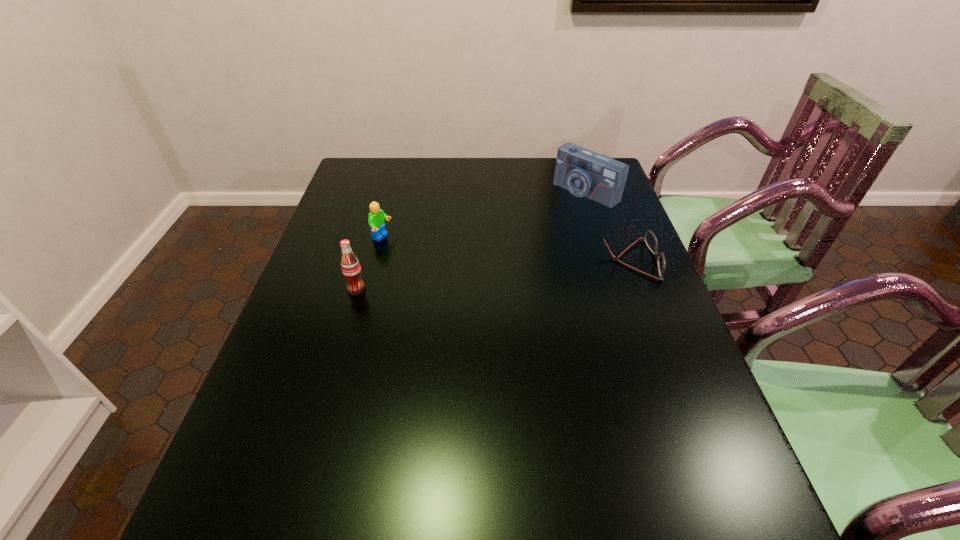
The image size is (960, 540). I want to click on the nearest object, so click(x=350, y=266).

Locate an element on the screen. The height and width of the screenshot is (540, 960). spectacles is located at coordinates (650, 239).

Find the location of a particular element. This screenshot has width=960, height=540. the farthest object is located at coordinates (584, 173).

You are a GUI agent. You are given a task and a screenshot of the screen. Output one action in this format:
    pyautogui.click(x=<x>, y=<y>)
    Task: Click on the third tallest object
    The width and height of the screenshot is (960, 540).
    Given the screenshot: What is the action you would take?
    pyautogui.click(x=376, y=219)

This screenshot has width=960, height=540. In order to click on free location located 0.150m on the right of the nearest object in this screenshot , I will do `click(424, 289)`.

Find the location of a particular element. The image size is (960, 540). vacant space located on the lens of the camera is located at coordinates (546, 219).

At what (x,y) coordinates should I click in order to perform the action: click on vacant space located 0.130m on the lens of the camera. Please return your answer as a coordinate pair (x, y). This screenshot has height=540, width=960. Looking at the image, I should click on (542, 221).

What are the coordinates of `free space located 0.250m on the lens of the camera` in the screenshot? It's located at (517, 239).

Locate an element on the screen. blank space located 0.330m on the face of the Lego is located at coordinates (491, 280).

Image resolution: width=960 pixels, height=540 pixels. I want to click on vacant space located on the face of the Lego, so click(x=477, y=275).